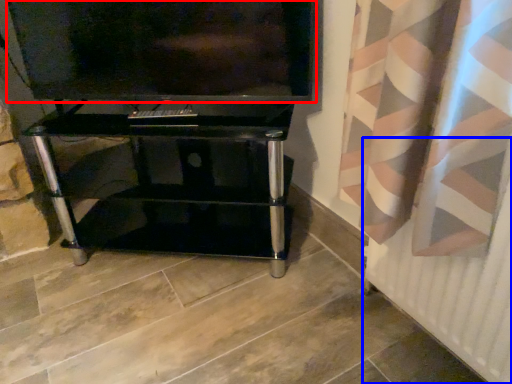
Question: Among these objects, which one is nearest to the camera, television (highlighted by a red box) or radiator (highlighted by a blue box)?

Choices:
 (A) television
 (B) radiator

Answer: (B)